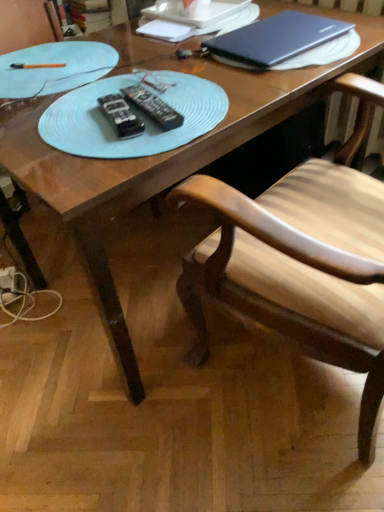
The width and height of the screenshot is (384, 512). What are the coordinates of `free point below light blue plastic plate at upper left (from a real-world perspective)` in the screenshot? It's located at (52, 75).